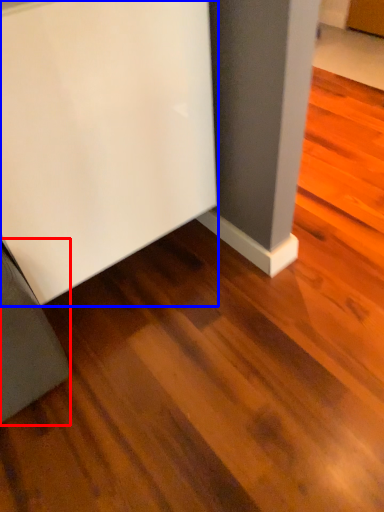
Question: Which point is further to the camera, furniture (highlighted by a red box) or furniture (highlighted by a blue box)?

Choices:
 (A) furniture
 (B) furniture

Answer: (A)